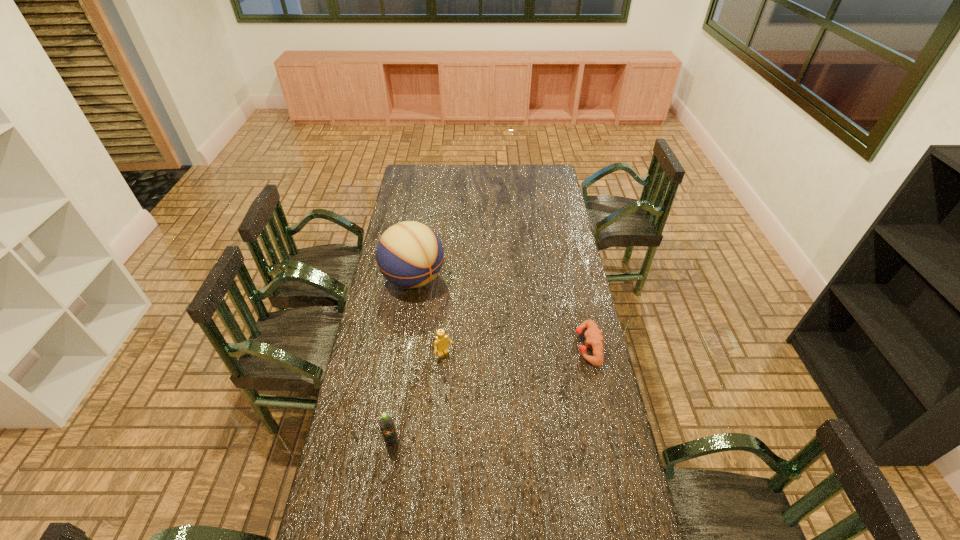
The image size is (960, 540). I want to click on the nearest object, so click(386, 423).

The width and height of the screenshot is (960, 540). What are the coordinates of `the second tallest object` in the screenshot? It's located at (386, 423).

At what (x,y) coordinates should I click in order to perform the action: click on the rightmost object. Please return your answer as a coordinate pair (x, y). This screenshot has width=960, height=540. Looking at the image, I should click on (593, 335).

Image resolution: width=960 pixels, height=540 pixels. I want to click on puncher, so click(593, 335).

Where is `the third tallest object`? the third tallest object is located at coordinates (441, 344).

I want to click on basketball, so point(409,254).

At what (x,y) coordinates should I click in order to perform the action: click on the farthest object. Please return your answer as a coordinate pair (x, y). This screenshot has width=960, height=540. Looking at the image, I should click on [x=409, y=254].

At what (x,y) coordinates should I click in order to perform the action: click on vacant area situated 0.200m on the front label of the nearest object. Please return your answer as a coordinate pair (x, y). The image size is (960, 540). Looking at the image, I should click on (381, 515).

The width and height of the screenshot is (960, 540). I want to click on vacant space located 0.080m with the gloves of the puncher facing forward, so click(555, 346).

Identify the location of vacant space situated 0.260m with the gloves of the puncher facing forward. (509, 346).